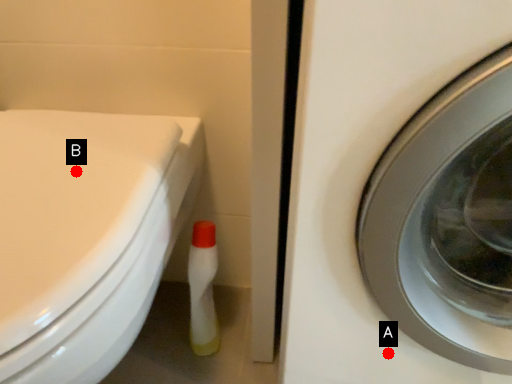
Question: Two points are circled on the image, labeled by A and B beside each circle. Among these points, which one is nearest to the camera?

Choices:
 (A) A is closer
 (B) B is closer

Answer: (B)